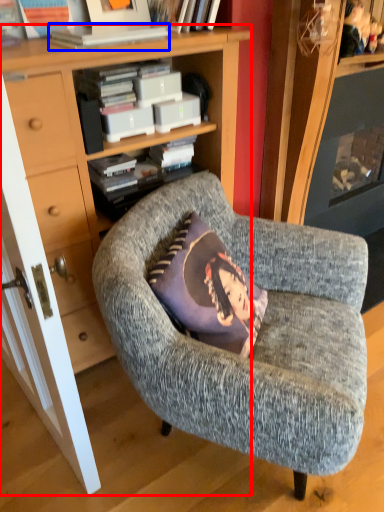
Question: Which of the following is the farthest to the observer, bookcase (highlighted by a red box) or book (highlighted by a blue box)?

Choices:
 (A) bookcase
 (B) book

Answer: (B)